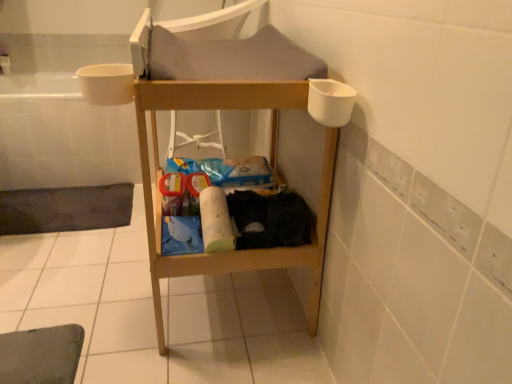
Question: Is white plastic bath at left inside white matte toilet paper at center?

Choices:
 (A) no
 (B) yes

Answer: (A)

Question: Considering the relative sizes of white matte toilet paper at center and white plastic bath at left in the image provided, is white matte toilet paper at center bigger than white plastic bath at left?

Choices:
 (A) yes
 (B) no

Answer: (B)

Question: Can you confirm if white matte toilet paper at center is positioned to the left of white plastic bath at left?

Choices:
 (A) yes
 (B) no

Answer: (B)

Question: From a real-world perspective, is white matte toilet paper at center positioned over white plastic bath at left based on gravity?

Choices:
 (A) yes
 (B) no

Answer: (A)

Question: Is white matte toilet paper at center positioned with its back to white plastic bath at left?

Choices:
 (A) yes
 (B) no

Answer: (B)

Question: Does white matte toilet paper at center turn towards white plastic bath at left?

Choices:
 (A) yes
 (B) no

Answer: (B)

Question: From a real-world perspective, does white plastic bath at left sit lower than dark gray mesh bath mat at lower left?

Choices:
 (A) yes
 (B) no

Answer: (B)

Question: From a real-world perspective, is white plastic bath at left on top of dark gray mesh bath mat at lower left?

Choices:
 (A) no
 (B) yes

Answer: (B)

Question: Can you confirm if white plastic bath at left is shorter than dark gray mesh bath mat at lower left?

Choices:
 (A) no
 (B) yes

Answer: (A)

Question: Considering the relative sizes of white plastic bath at left and dark gray mesh bath mat at lower left in the image provided, is white plastic bath at left bigger than dark gray mesh bath mat at lower left?

Choices:
 (A) no
 (B) yes

Answer: (B)

Question: Is white plastic bath at left in contact with dark gray mesh bath mat at lower left?

Choices:
 (A) no
 (B) yes

Answer: (A)

Question: Is white plastic bath at left to the right of dark gray mesh bath mat at lower left from the viewer's perspective?

Choices:
 (A) yes
 (B) no

Answer: (A)

Question: Are dark gray mesh bath mat at lower left and white plastic bath at left located far from each other?

Choices:
 (A) no
 (B) yes

Answer: (A)